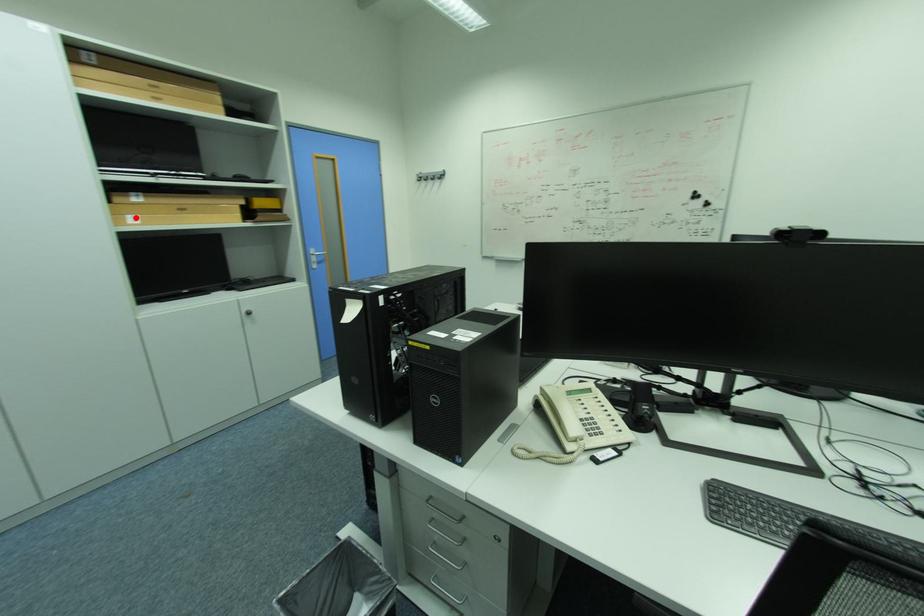
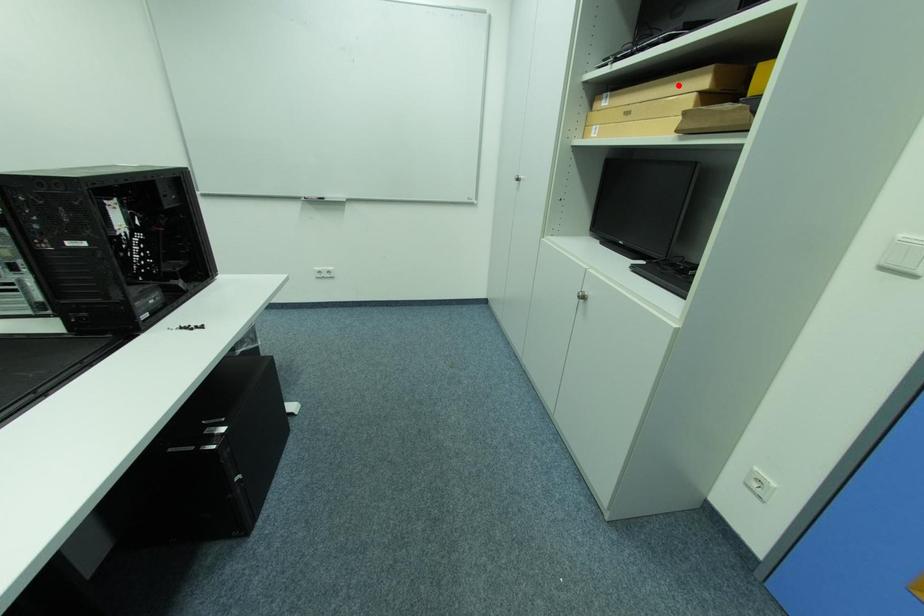
Looking at this image, I am providing you with two images of the same scene from different viewpoints. A red point is marked on the first image and another point is marked on the second image. Is the marked point in image1 the same physical position as the marked point in image2?

No